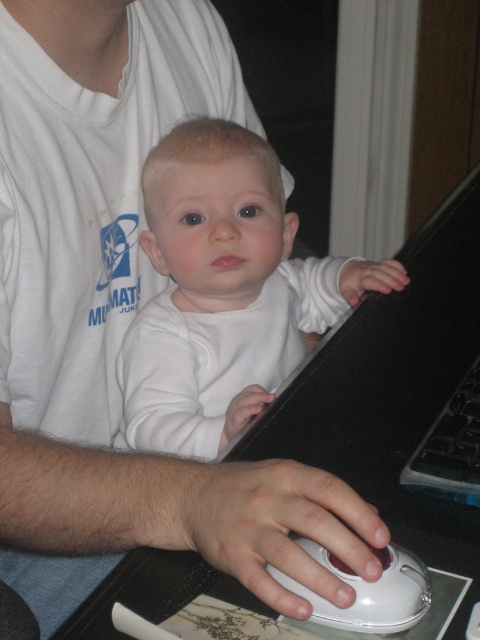
Who is lower down, white plastic mouse at lower center or black plastic keyboard at lower right?

white plastic mouse at lower center is lower down.

What do you see at coordinates (368, 589) in the screenshot? Image resolution: width=480 pixels, height=640 pixels. I see `white plastic mouse at lower center` at bounding box center [368, 589].

Where is `white plastic mouse at lower center`? Image resolution: width=480 pixels, height=640 pixels. white plastic mouse at lower center is located at coordinates (368, 589).

Does point (299, 282) come behind point (360, 577)?

Yes, it is behind point (360, 577).

Measure the distance from white matte baby at center to white plastic mouse at lower center.

16.37 inches

Which is behind, point (199, 141) or point (410, 618)?

The point (199, 141) is more distant.

You are a GUI agent. You are given a task and a screenshot of the screen. Output one action in this format:
    pyautogui.click(x=<x>, y=<y>)
    Task: Click on the white matte baby at center
    The width and height of the screenshot is (480, 640).
    Given the screenshot: What is the action you would take?
    pyautogui.click(x=224, y=291)

This screenshot has width=480, height=640. Describe the element at coordinates (224, 291) in the screenshot. I see `white matte baby at center` at that location.

Which is in front, point (163, 141) or point (456, 392)?

Point (456, 392) is in front.

Identify the location of white matte baby at center. (224, 291).